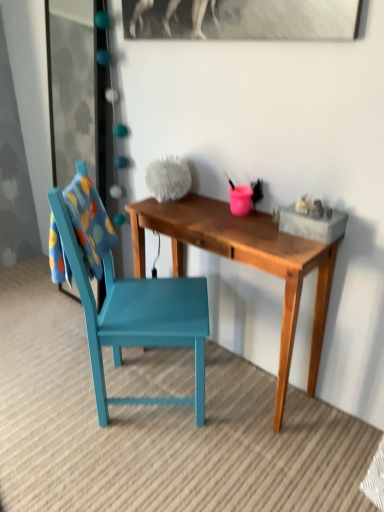
Locate an element on the screen. vacant area that lies between wooden desk at center and teal painted wood chair at left is located at coordinates (210, 422).